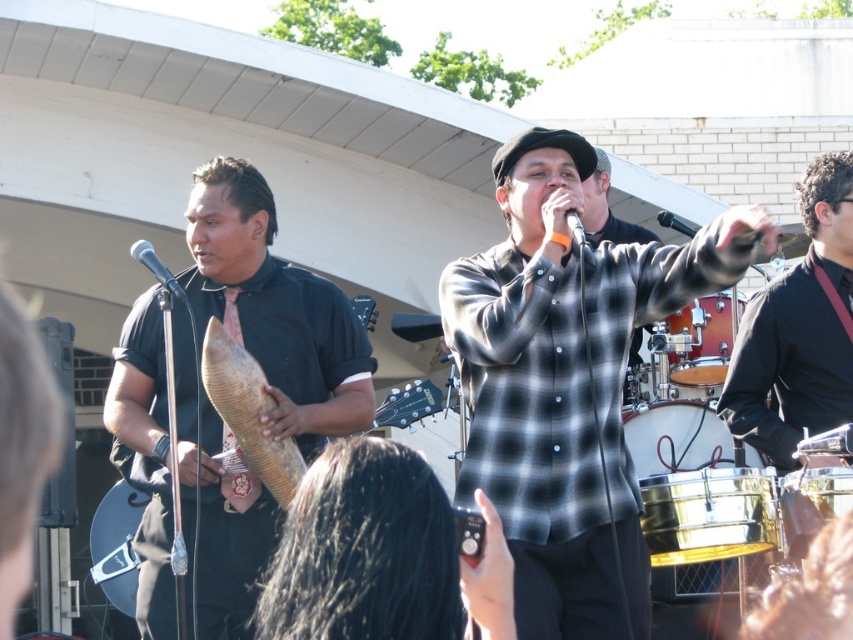
The image size is (853, 640). Describe the element at coordinates (567, 381) in the screenshot. I see `black checkered shirt at center` at that location.

Image resolution: width=853 pixels, height=640 pixels. What do you see at coordinates (567, 381) in the screenshot?
I see `black checkered shirt at center` at bounding box center [567, 381].

Where is `black checkered shirt at center`? This screenshot has height=640, width=853. black checkered shirt at center is located at coordinates (567, 381).

Can you confirm if white drumhead at center is smaller than black matte microphone at upper center?

No.

Does white drumhead at center have a greater height compared to black matte microphone at upper center?

Indeed, white drumhead at center has a greater height compared to black matte microphone at upper center.

Who is more distant from viewer, (677, 404) or (679, 221)?

Point (679, 221)

You are a GUI agent. You are given a task and a screenshot of the screen. Output one action in this format:
    pyautogui.click(x=<x>, y=<y>)
    Task: Click on the white drumhead at center
    Image resolution: width=853 pixels, height=640 pixels.
    Given the screenshot: What is the action you would take?
    pyautogui.click(x=676, y=436)

Which is in front, point (697, 525) or point (172, 280)?

Point (697, 525)

Between point (706, 515) and point (178, 291), which one is positioned in front?

Point (706, 515)

You are a GUI agent. You are given a task and a screenshot of the screen. Output one action in this format:
    pyautogui.click(x=<x>, y=<y>)
    Task: Click on the gold metallic drum at lower right
    
    Given the screenshot: What is the action you would take?
    pyautogui.click(x=708, y=515)